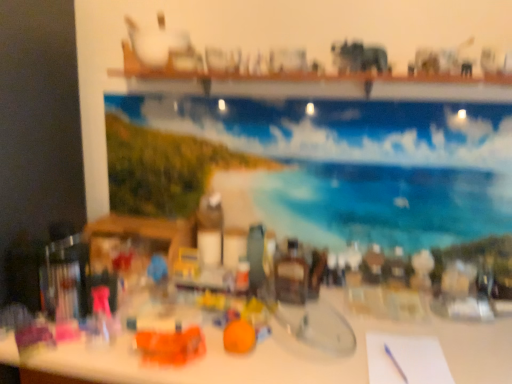
The image size is (512, 384). I want to click on free space to the back side of orange matte toy at center, which is the 2th toy from left to right, so click(259, 323).